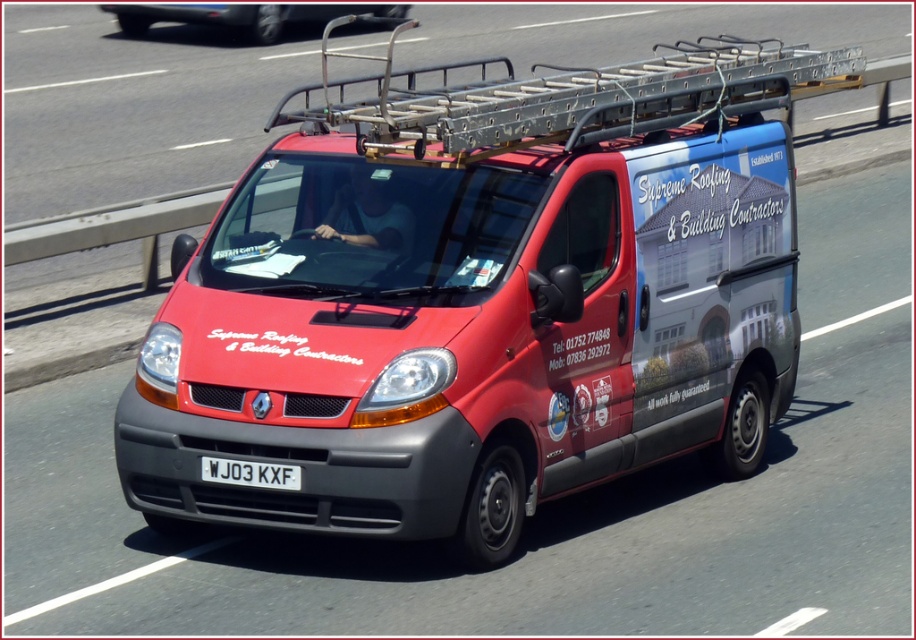
You are a photographer trying to capture the van from the front. You notice two points marked on the van, one at coordinates point (183,4) and the other at point (293,467). Which point is closer to the camera?

Point (293,467) is closer to the camera than point (183,4) because the description states that point (183,4) is further away.

What are the coordinates of the matte red van at center?

The coordinates of the matte red van at center are at point (481, 298).

You are a pedestrian standing on the sidewalk. You see a matte red van at center and a white plastic license plate at center. Which object is closer to you?

The matte red van at center is closer to you because it is positioned further to the viewer than the white plastic license plate at center.